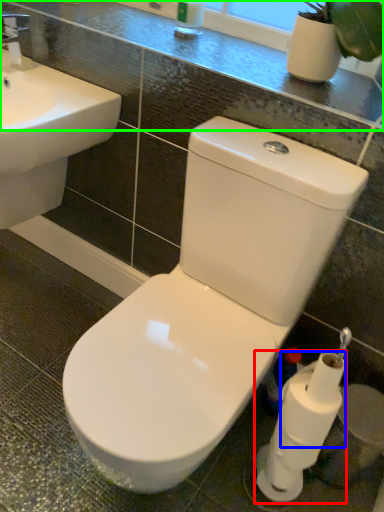
Question: Which object is positioned closest to toilet paper (highlighted by a red box)? Select from toilet paper (highlighted by a blue box) and counter top (highlighted by a green box).

Choices:
 (A) toilet paper
 (B) counter top

Answer: (A)